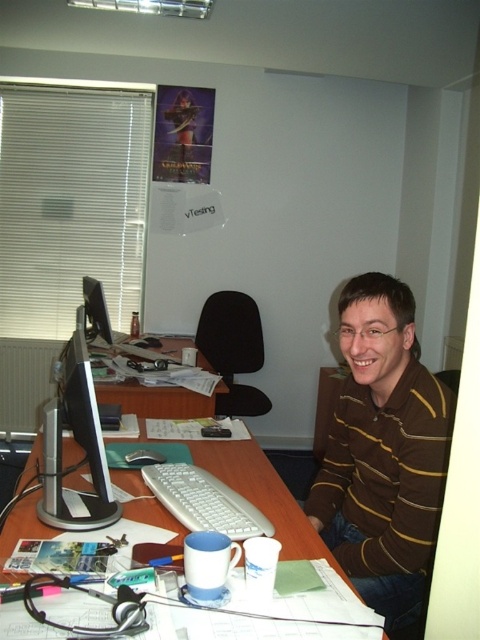
You are organizing the office supplies on the wooden desk at center and the matte black monitor at left. Since you need to place a new item that requires more vertical space, which object should you choose based on their heights?

The matte black monitor at left is taller than the wooden desk at center, so you should place the new item on the matte black monitor at left to accommodate the vertical space needed.

You are organizing a desk and need to place a new keyboard that requires 1 meter of space. Given the wooden desk at center and the matte black monitor at left, which object provides enough space for the keyboard?

The wooden desk at center has a larger size compared to the matte black monitor at left, so the wooden desk at center can provide enough space for the keyboard.